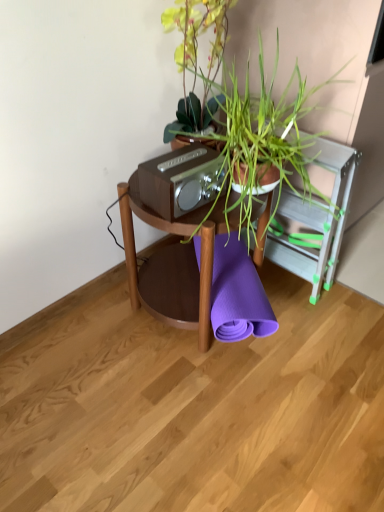
This screenshot has width=384, height=512. What are the coordinates of `vacant space to the right of woodenmaterial/texturetable at center` in the screenshot? It's located at (313, 334).